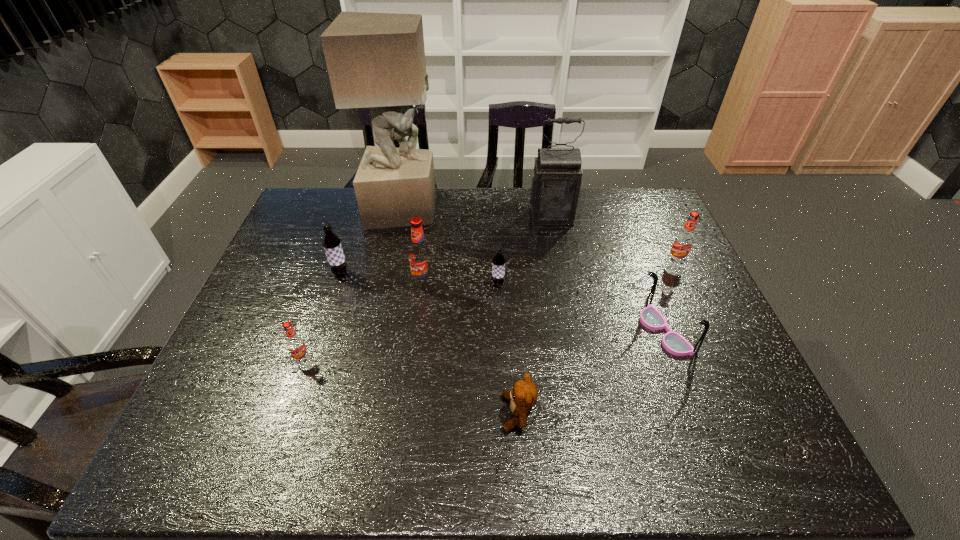
Locate an element on the screen. spectacles is located at coordinates (650, 317).

The width and height of the screenshot is (960, 540). I want to click on the leftmost red root beer, so click(295, 343).

Where is `the nearest root beer`? the nearest root beer is located at coordinates (x=295, y=343).

Locate an element on the screen. the right brown root beer is located at coordinates (498, 262).

You are a GUI agent. You are given a task and a screenshot of the screen. Output one action in this format:
    pyautogui.click(x=<x>, y=<y>)
    Task: Click on the second root beer from right to left
    Image resolution: width=960 pixels, height=540 pixels.
    Given the screenshot: What is the action you would take?
    pyautogui.click(x=498, y=262)

In order to click on the nearest object in this screenshot , I will do `click(523, 396)`.

The width and height of the screenshot is (960, 540). In order to click on teddy bear in this screenshot , I will do `click(523, 396)`.

The width and height of the screenshot is (960, 540). What are the coordinates of `vacant point located 0.340m on the front-facing side of the sculpture` in the screenshot? It's located at (536, 210).

Image resolution: width=960 pixels, height=540 pixels. In order to click on free location located 0.310m on the front-facing side of the third object from right to left in this screenshot , I will do `click(566, 296)`.

I want to click on free region located on the right of the biggest red root beer, so click(503, 283).